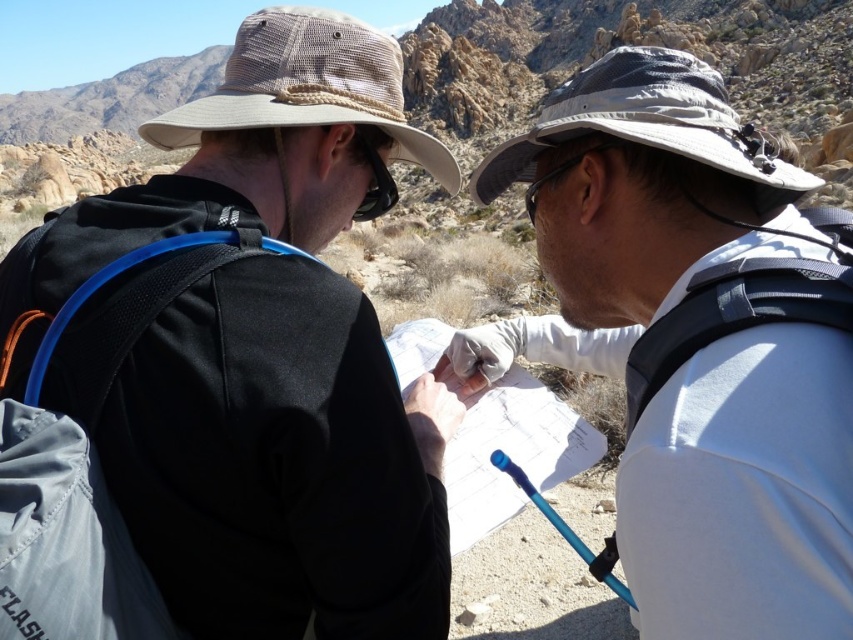
Question: Can you confirm if black matte jacket at upper left is bigger than white matte paper at center?

Choices:
 (A) no
 (B) yes

Answer: (B)

Question: Which point is farther from the camera taking this photo?

Choices:
 (A) (375, 83)
 (B) (849, 609)

Answer: (A)

Question: Can you confirm if black matte jacket at upper left is thinner than white matte paper at center?

Choices:
 (A) yes
 (B) no

Answer: (B)

Question: Considering the relative positions of white matte paper at center and white paper at center in the image provided, where is white matte paper at center located with respect to white paper at center?

Choices:
 (A) above
 (B) below

Answer: (A)

Question: Which object is farther from the camera taking this photo?

Choices:
 (A) white matte paper at center
 (B) black matte jacket at upper left

Answer: (B)

Question: Which point is farther to the camera?

Choices:
 (A) (102, 612)
 (B) (471, 432)

Answer: (B)